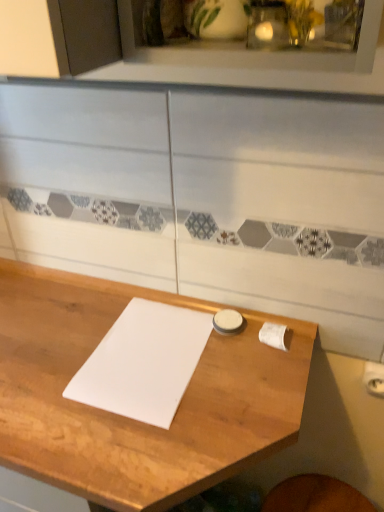
Where is `free space to the back side of white matte journal at center`? This screenshot has height=512, width=384. free space to the back side of white matte journal at center is located at coordinates (122, 300).